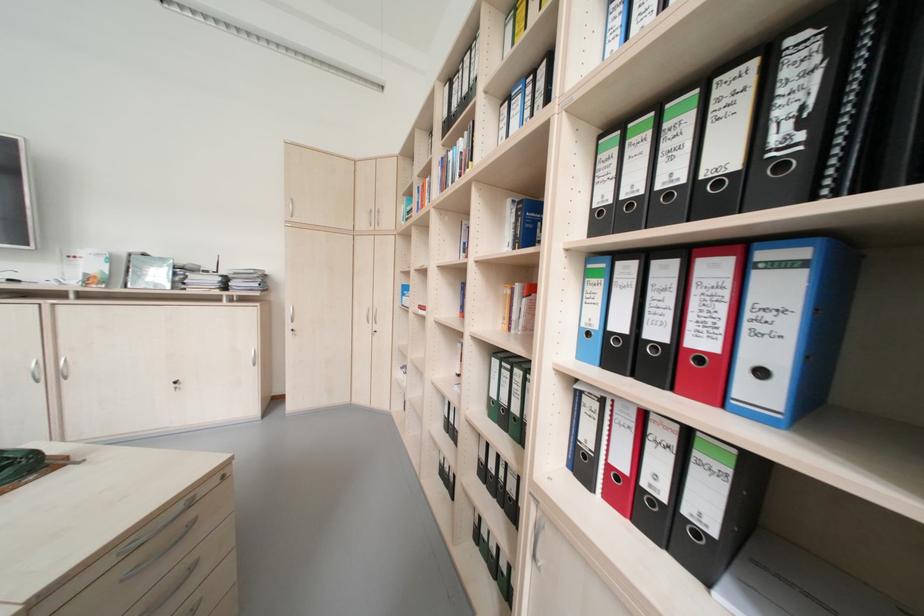
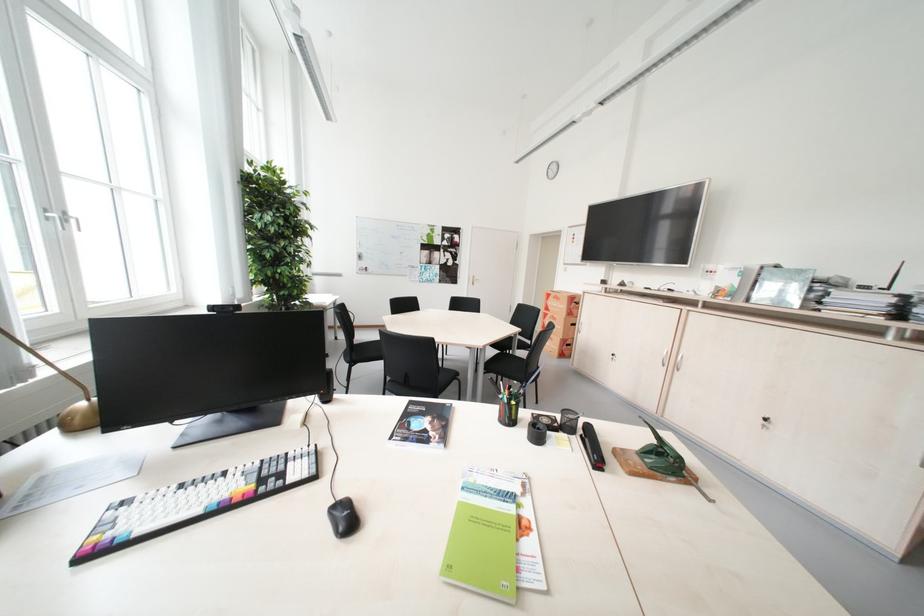
The point at (186, 384) is marked in the first image. Where is the corresponding point in the second image?

(775, 421)